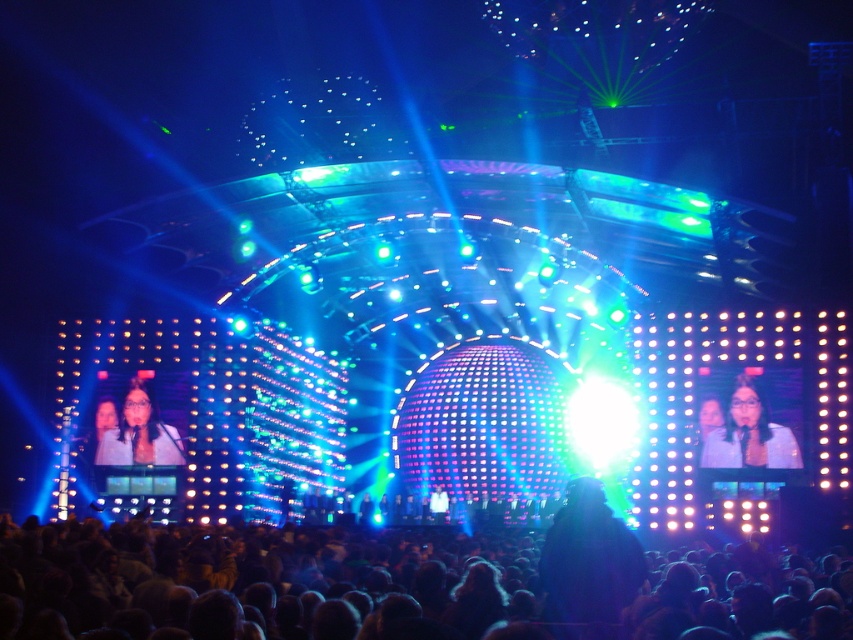
Question: Which point is farther to the camera?

Choices:
 (A) matte white shirt at right
 (B) matte white microphone at center
 (C) dark hair at lower center

Answer: (B)

Question: Considering the relative positions of dark hair at lower center and matte white shirt at right in the image provided, where is dark hair at lower center located with respect to matte white shirt at right?

Choices:
 (A) left
 (B) right

Answer: (A)

Question: Based on their relative distances, which object is farther from the matte white microphone at center?

Choices:
 (A) matte white shirt at right
 (B) dark hair at lower center

Answer: (A)

Question: Can you confirm if matte white shirt at right is bigger than matte white microphone at center?

Choices:
 (A) no
 (B) yes

Answer: (A)

Question: Can you confirm if dark hair at lower center is wider than matte white microphone at center?

Choices:
 (A) no
 (B) yes

Answer: (B)

Question: Which object appears closest to the camera in this image?

Choices:
 (A) dark hair at lower center
 (B) matte white shirt at right
 (C) matte white microphone at center

Answer: (A)